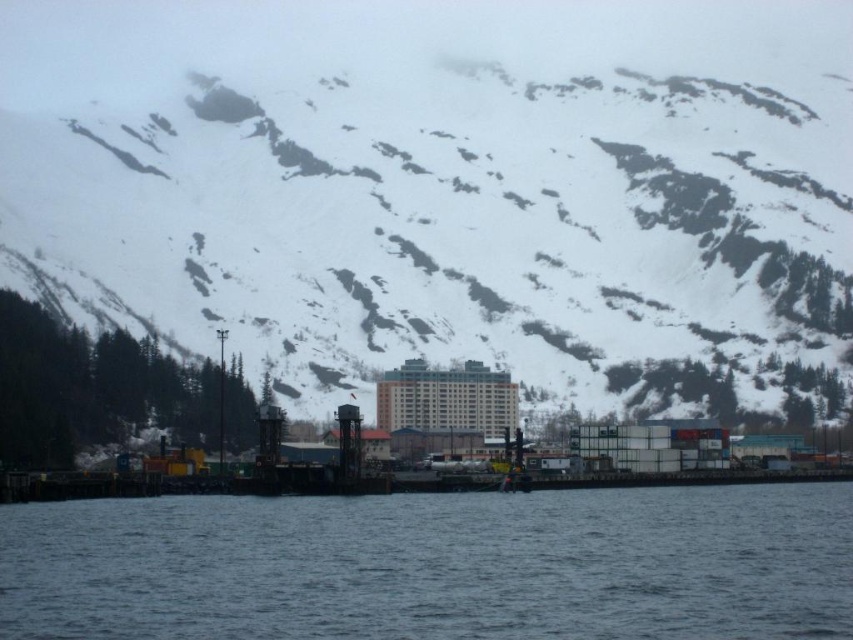
Question: Is snowy rock at upper center to the right of dark blue water at lower center from the viewer's perspective?

Choices:
 (A) no
 (B) yes

Answer: (A)

Question: Which of the following is the farthest from the observer?

Choices:
 (A) (234, 621)
 (B) (844, 196)

Answer: (B)

Question: In this image, where is snowy rock at upper center located relative to dark blue water at lower center?

Choices:
 (A) left
 (B) right

Answer: (A)

Question: Is snowy rock at upper center above dark blue water at lower center?

Choices:
 (A) no
 (B) yes

Answer: (B)

Question: Which point is farther to the camera?

Choices:
 (A) dark blue water at lower center
 (B) snowy rock at upper center

Answer: (B)

Question: Which of the following is the closest to the observer?

Choices:
 (A) snowy rock at upper center
 (B) dark blue water at lower center

Answer: (B)